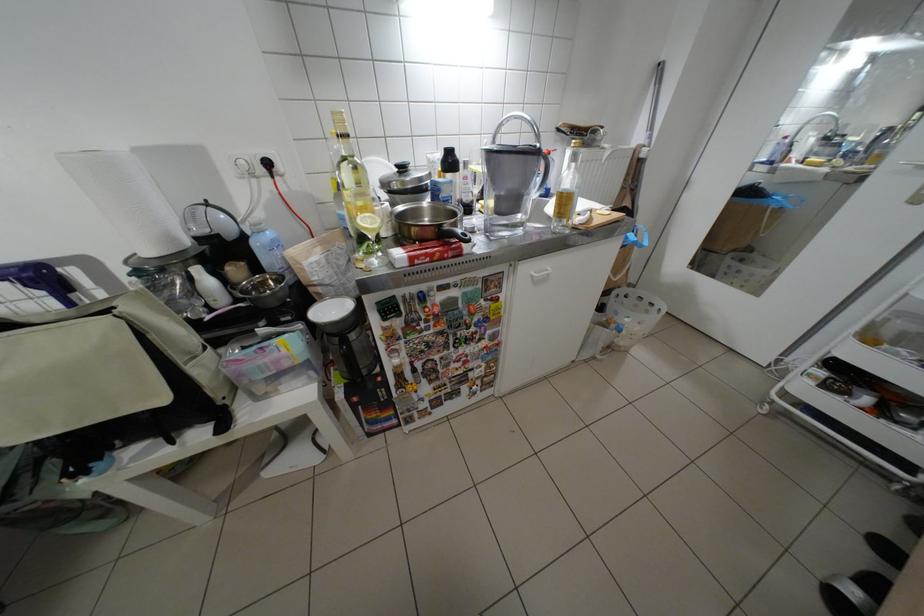
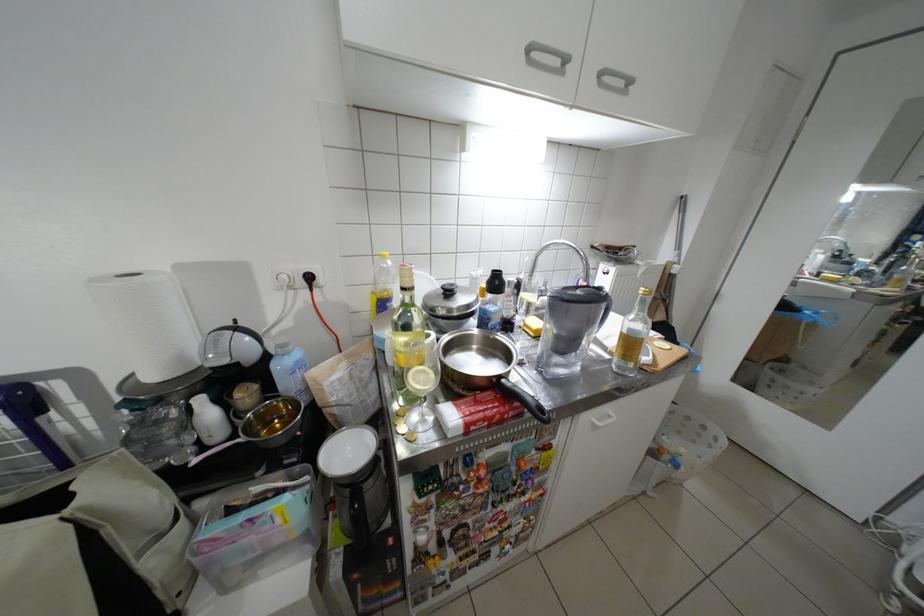
Locate, in the second image, the point that corresponds to (x=372, y=222) in the first image.

(426, 379)